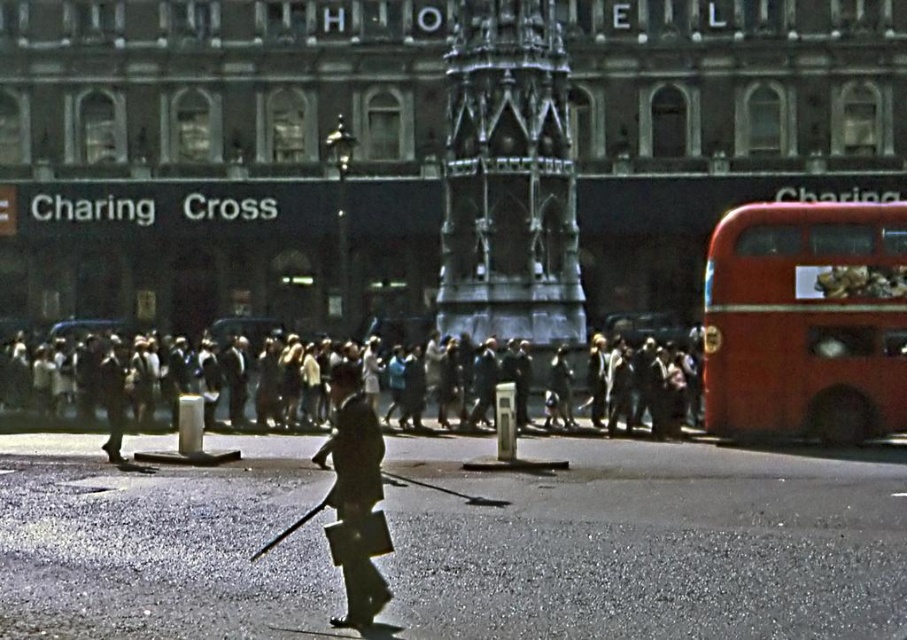
You are a pedestrian standing at the left edge of the scene. You want to cross the street to reach the monument in the center. There is a red rubber bus at right and a dark gray concrete crowd at center. Which object is closer to your current position?

The dark gray concrete crowd at center is closer to your current position because the red rubber bus at right is positioned on the right side of the dark gray concrete crowd at center, meaning the crowd is between you and the bus.

You are standing at the point marked as point (900,240) in the image. A friend is waiting at your current position. Can you hear your friend if they shout from their location?

The point (900,240) is 161.20 feet away from the viewer. Since the distance is quite large, you might not be able to hear your friend clearly if they shout from that distance.